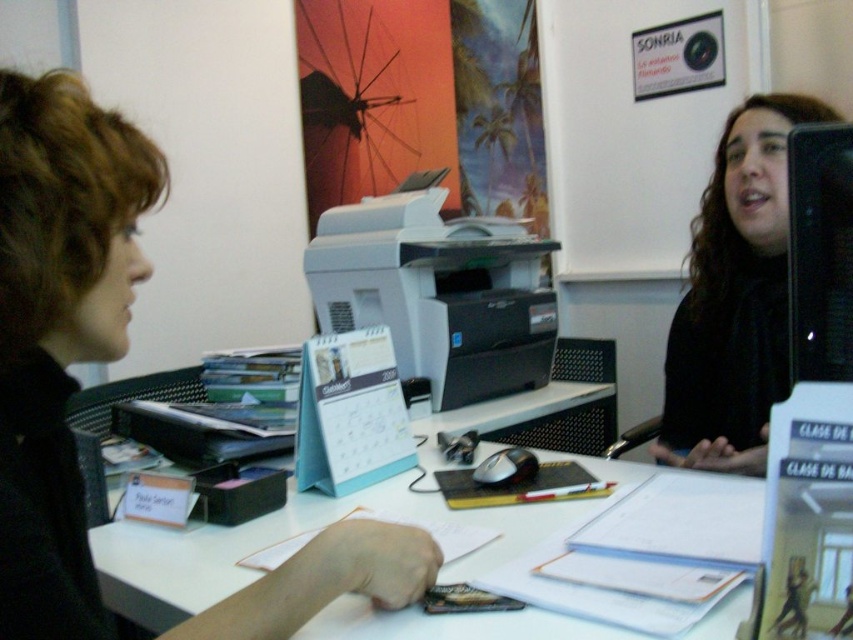
Question: Does black matte shirt at center appear over black glossy monitor at upper right?

Choices:
 (A) no
 (B) yes

Answer: (A)

Question: Can you confirm if matte black hair at left is smaller than black glossy monitor at upper right?

Choices:
 (A) yes
 (B) no

Answer: (B)

Question: Is the position of white matte printer at center more distant than that of black glossy monitor at upper right?

Choices:
 (A) no
 (B) yes

Answer: (B)

Question: Which of the following is the closest to the observer?

Choices:
 (A) (520, 266)
 (B) (825, 230)
 (C) (463, 624)
 (D) (782, 388)

Answer: (C)

Question: Which point is farther to the camera?

Choices:
 (A) white paper at center
 (B) matte black hair at left
 (C) black glossy monitor at upper right
 (D) white matte printer at center

Answer: (D)

Question: Which object is the closest to the matte black hair at left?

Choices:
 (A) black glossy monitor at upper right
 (B) white matte printer at center
 (C) white paper at center

Answer: (C)